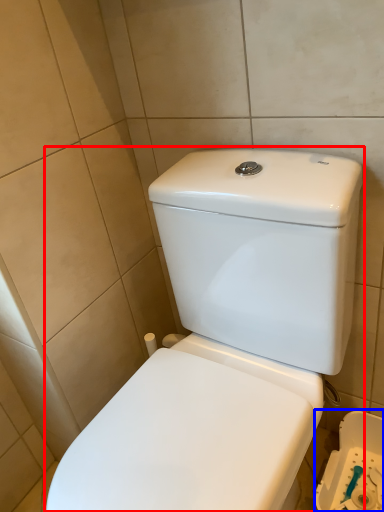
Question: Among these objects, which one is farthest to the camera, toilet (highlighted by a red box) or porcelain (highlighted by a blue box)?

Choices:
 (A) toilet
 (B) porcelain

Answer: (B)